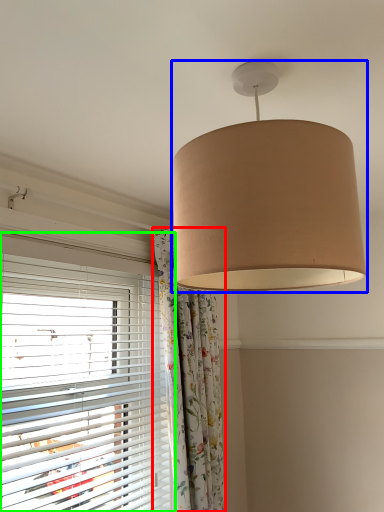
Question: Based on their relative distances, which object is farther from curtain (highlighted by a red box)? Choose from lamp (highlighted by a blue box) and window blind (highlighted by a green box).

Choices:
 (A) lamp
 (B) window blind

Answer: (A)